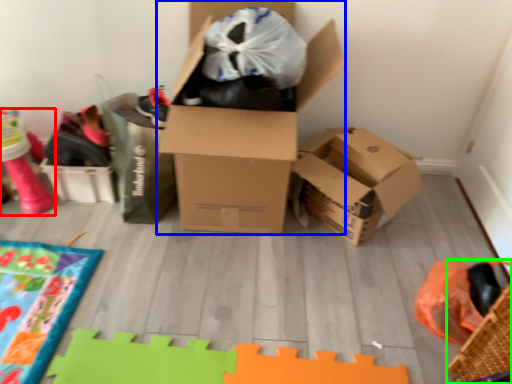
Question: Which object is positioned farthest from toy (highlighted by a red box)? Select from box (highlighted by a blue box) and basket (highlighted by a green box).

Choices:
 (A) box
 (B) basket

Answer: (B)